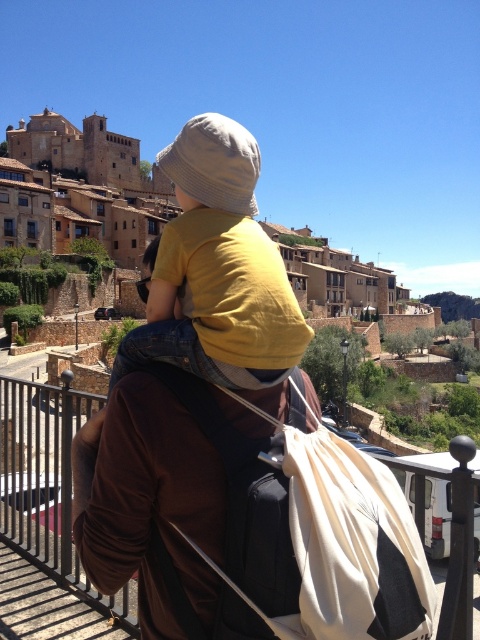
Can you confirm if matte yellow shirt at center is positioned to the right of metallic gray railing at center?

Yes, matte yellow shirt at center is to the right of metallic gray railing at center.

What do you see at coordinates (216, 269) in the screenshot?
I see `matte yellow shirt at center` at bounding box center [216, 269].

The width and height of the screenshot is (480, 640). I want to click on matte yellow shirt at center, so click(216, 269).